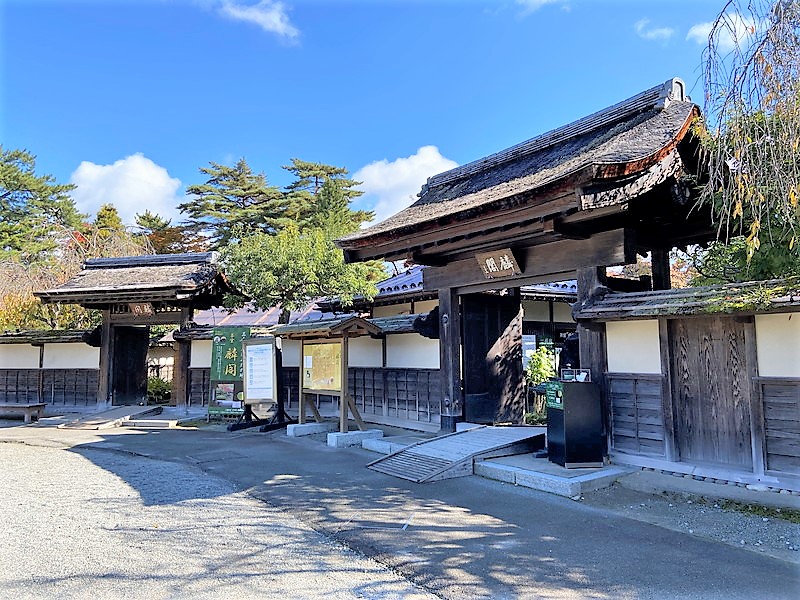
Identify the location of walls. Image resolution: width=800 pixels, height=600 pixels. (636, 351), (782, 340), (386, 354), (202, 352), (42, 358).